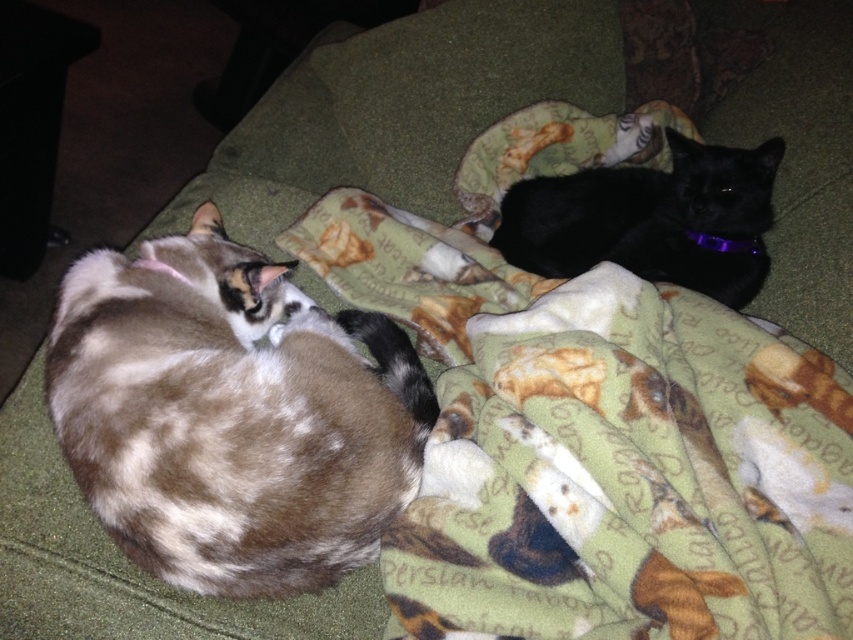
Can you confirm if calico fur cat at center is positioned above purple fabric neckband at upper right?

Incorrect, calico fur cat at center is not positioned above purple fabric neckband at upper right.

Is calico fur cat at center below purple fabric neckband at upper right?

Yes, calico fur cat at center is below purple fabric neckband at upper right.

What are the coordinates of `calico fur cat at center` in the screenshot? It's located at (231, 416).

Based on the photo, is calico fur cat at center thinner than black matte/black fur cat at upper right?

No, calico fur cat at center is not thinner than black matte/black fur cat at upper right.

Consider the image. Does calico fur cat at center have a lesser height compared to black matte/black fur cat at upper right?

No.

Is point (131, 474) closer to viewer compared to point (764, 150)?

Yes.

Identify the location of calico fur cat at center. (231, 416).

Is green fleece blanket at center smaller than black matte/black fur cat at upper right?

Incorrect, green fleece blanket at center is not smaller in size than black matte/black fur cat at upper right.

Can you confirm if green fleece blanket at center is positioned to the right of black matte/black fur cat at upper right?

Incorrect, green fleece blanket at center is not on the right side of black matte/black fur cat at upper right.

Does point (462, 292) come farther from viewer compared to point (753, 163)?

Yes, point (462, 292) is farther from viewer.

The width and height of the screenshot is (853, 640). Find the location of `green fleece blanket at center`. green fleece blanket at center is located at coordinates (595, 426).